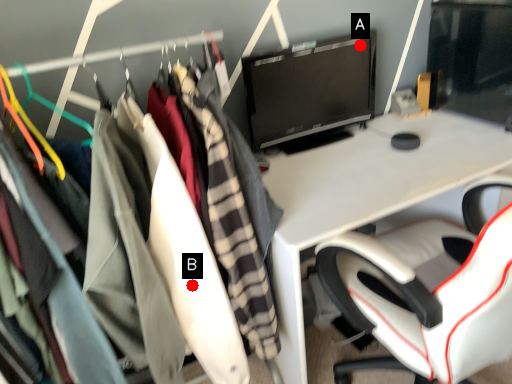
Question: Two points are circled on the image, labeled by A and B beside each circle. Which point appears farthest from the camera in this image?

Choices:
 (A) A is further
 (B) B is further

Answer: (A)